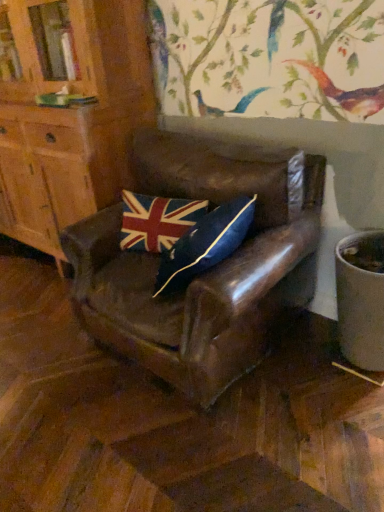
Question: Can we say matte wood cabinet at left lies outside union jack fabric pillow at center?

Choices:
 (A) no
 (B) yes

Answer: (B)

Question: Is matte wood cabinet at left aimed at union jack fabric pillow at center?

Choices:
 (A) no
 (B) yes

Answer: (A)

Question: Is matte wood cabinet at left shorter than union jack fabric pillow at center?

Choices:
 (A) yes
 (B) no

Answer: (B)

Question: From a real-world perspective, is matte wood cabinet at left positioned under union jack fabric pillow at center based on gravity?

Choices:
 (A) no
 (B) yes

Answer: (A)

Question: Considering the relative sizes of matte wood cabinet at left and union jack fabric pillow at center in the image provided, is matte wood cabinet at left wider than union jack fabric pillow at center?

Choices:
 (A) no
 (B) yes

Answer: (B)

Question: Considering the positions of leather chair at center and matte wood cabinet at left in the image, is leather chair at center wider or thinner than matte wood cabinet at left?

Choices:
 (A) thin
 (B) wide

Answer: (B)

Question: In terms of height, does leather chair at center look taller or shorter compared to matte wood cabinet at left?

Choices:
 (A) tall
 (B) short

Answer: (B)

Question: Based on their positions, is leather chair at center located to the left or right of matte wood cabinet at left?

Choices:
 (A) right
 (B) left

Answer: (A)

Question: Choose the correct answer: Is leather chair at center inside matte wood cabinet at left or outside it?

Choices:
 (A) outside
 (B) inside

Answer: (A)

Question: Does point (201, 200) appear closer or farther from the camera than point (170, 317)?

Choices:
 (A) farther
 (B) closer

Answer: (A)

Question: Would you say union jack fabric pillow at center is to the left or to the right of leather chair at center in the picture?

Choices:
 (A) left
 (B) right

Answer: (A)

Question: From the image's perspective, is union jack fabric pillow at center positioned above or below leather chair at center?

Choices:
 (A) above
 (B) below

Answer: (A)

Question: In terms of size, does union jack fabric pillow at center appear bigger or smaller than leather chair at center?

Choices:
 (A) small
 (B) big

Answer: (A)

Question: Relative to union jack fabric pillow at center, is leather chair at center in front or behind?

Choices:
 (A) front
 (B) behind

Answer: (A)

Question: Is leather chair at center to the left or to the right of union jack fabric pillow at center in the image?

Choices:
 (A) left
 (B) right

Answer: (B)